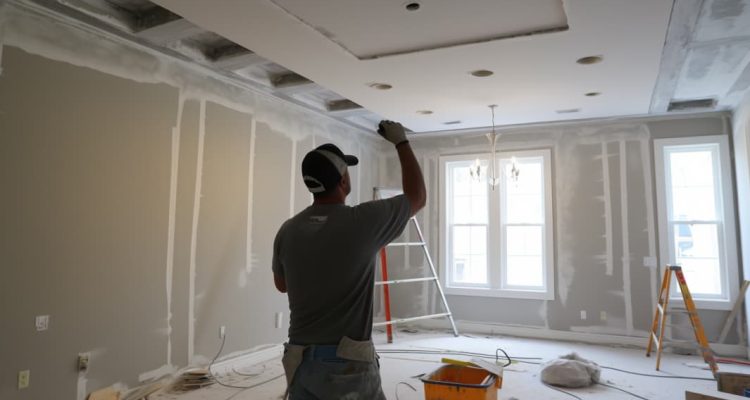
Where is `ladder`? ladder is located at coordinates (691, 307), (402, 281).